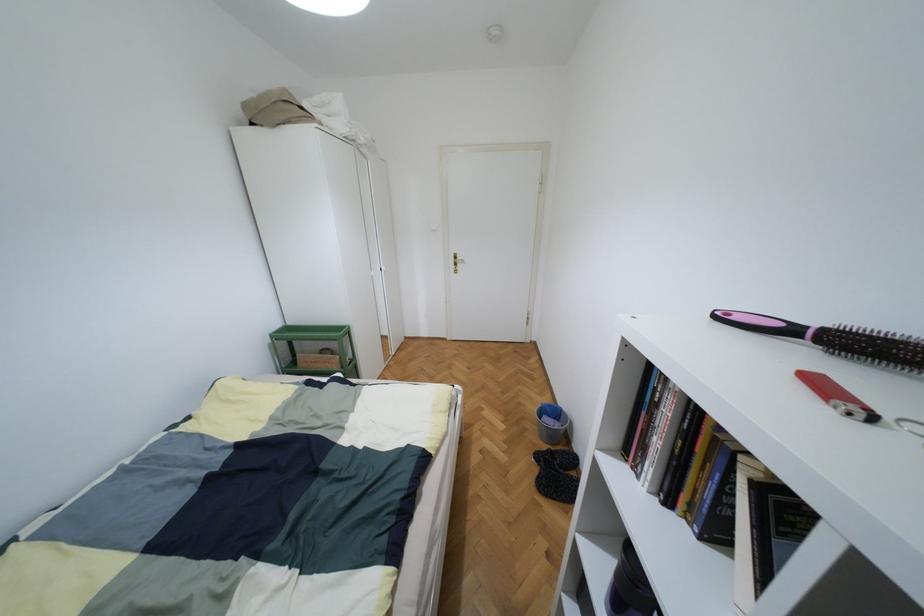
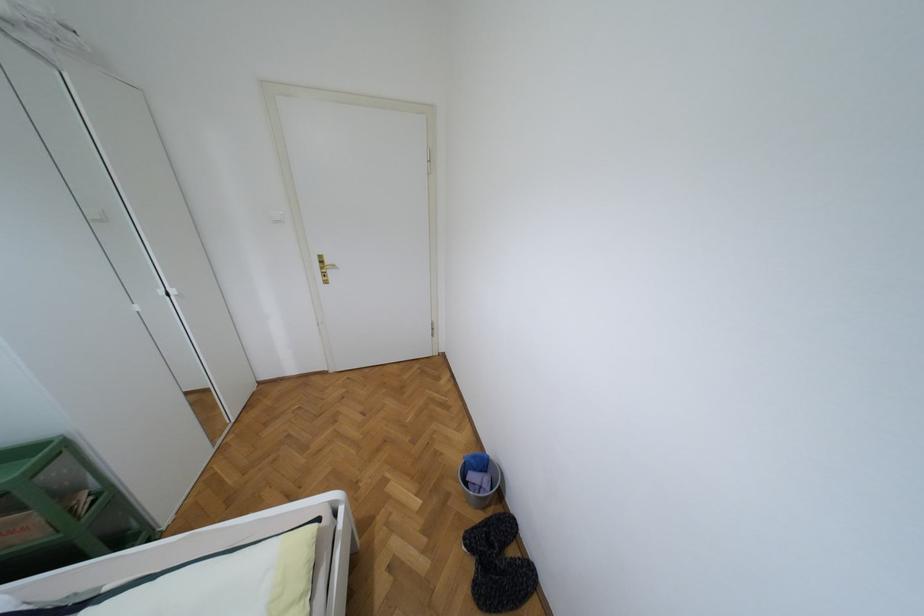
Question: In a continuous first-person perspective shot, in which direction is the camera moving?

Choices:
 (A) Left
 (B) Right
 (C) Forward
 (D) Backward

Answer: (C)